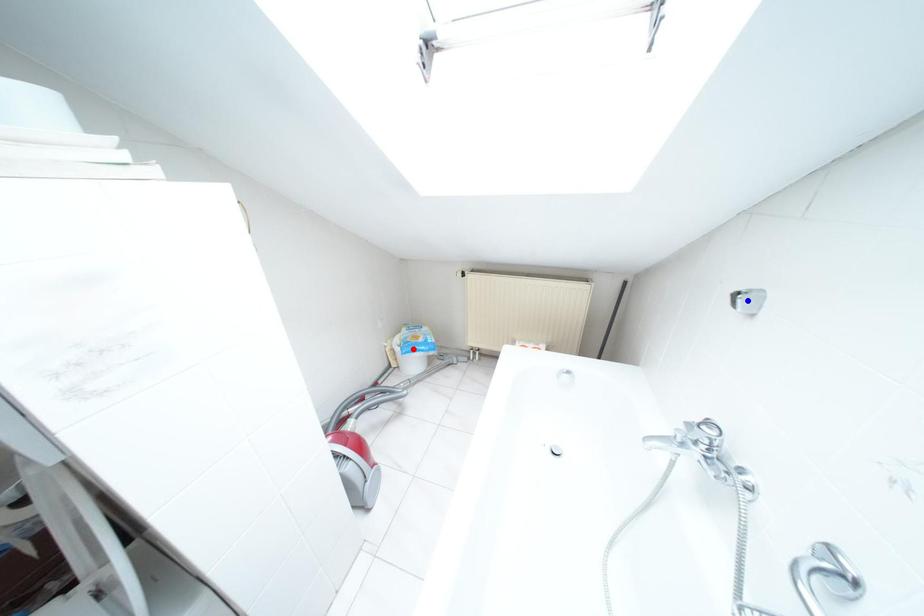
Question: In the image, two points are highlighted. Which point is nearer to the camera? Reply with the corresponding letter.

Choices:
 (A) blue point
 (B) red point

Answer: (A)